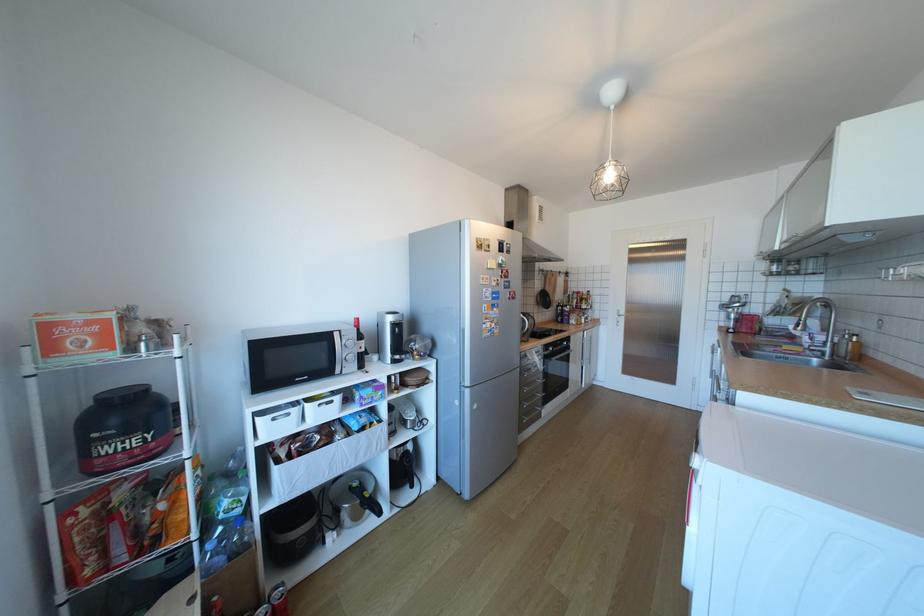
Where would you lift the black whey container? Please return your answer as a coordinate pair (x, y).

(122, 429)